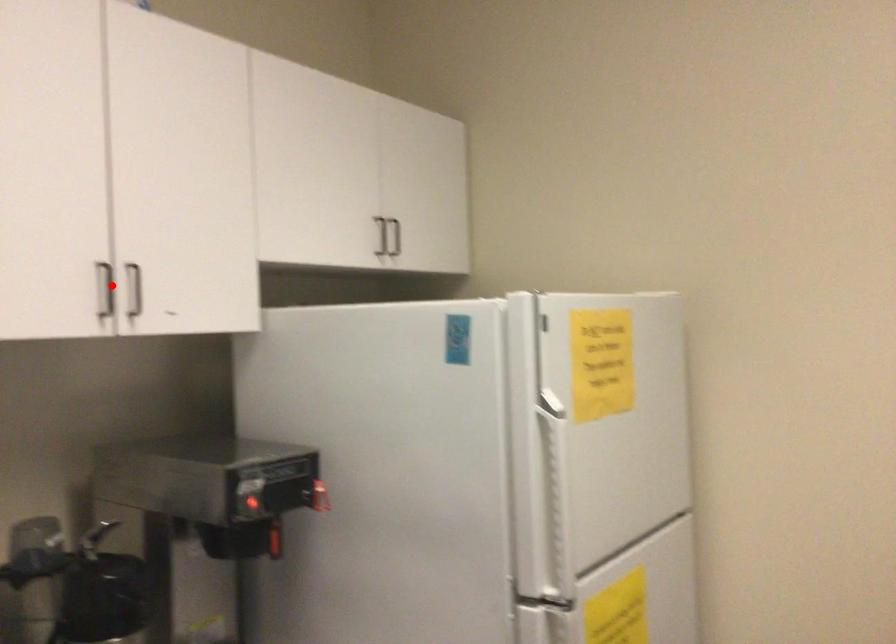
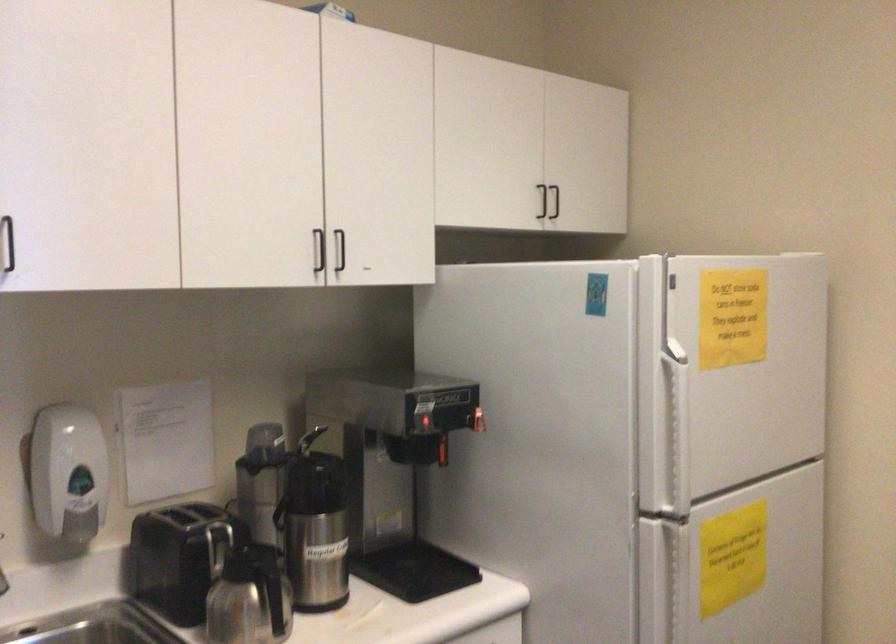
Question: I am providing you with two images of the same scene from different viewpoints. Image1 has a red point marked. In image2, the corresponding 3D location appears at what relative position? Reply with the corresponding letter.

Choices:
 (A) Closer
 (B) Farther

Answer: (B)